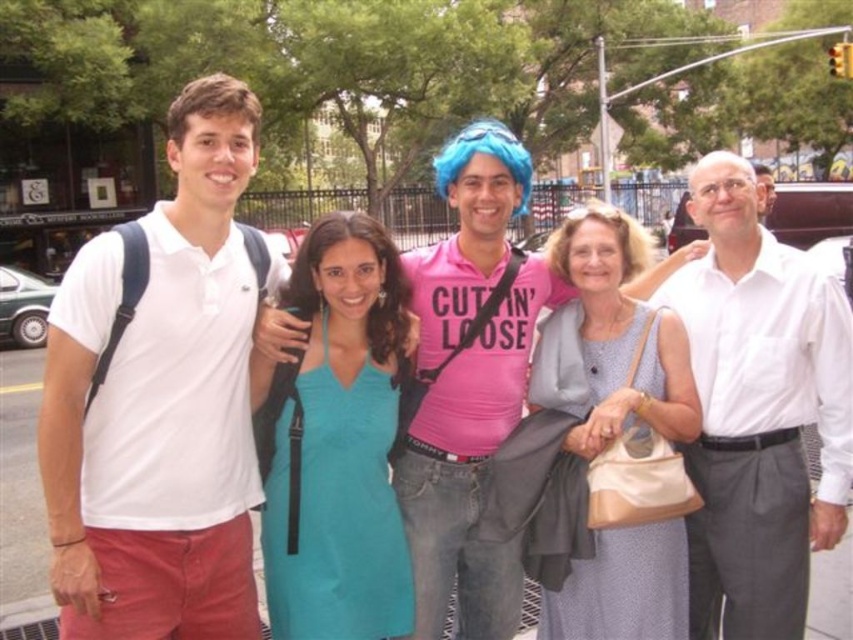
Who is more forward, (172, 404) or (631, 445)?

Positioned in front is point (172, 404).

Which is above, white cotton polo shirt at left or light blue fabric dress at center?

light blue fabric dress at center is above.

Between point (193, 310) and point (576, 280), which one is positioned behind?

The point (576, 280) is more distant.

The width and height of the screenshot is (853, 640). Identify the location of white cotton polo shirt at left. (160, 403).

Who is taller, white cotton polo shirt at left or white cotton shirt at right?

white cotton shirt at right is taller.

Can you confirm if white cotton polo shirt at left is taller than white cotton shirt at right?

No, white cotton polo shirt at left is not taller than white cotton shirt at right.

Between point (202, 292) and point (724, 269), which one is positioned in front?

Point (202, 292) is more forward.

Locate an element on the screen. This screenshot has height=640, width=853. white cotton polo shirt at left is located at coordinates (160, 403).

Based on the photo, who is lower down, white cotton shirt at right or light blue fabric dress at center?

white cotton shirt at right

Between white cotton shirt at right and light blue fabric dress at center, which one appears on the right side from the viewer's perspective?

Positioned to the right is white cotton shirt at right.

Which is behind, point (780, 440) or point (595, 342)?

Point (595, 342)

Find the location of a particular element. white cotton shirt at right is located at coordinates (758, 410).